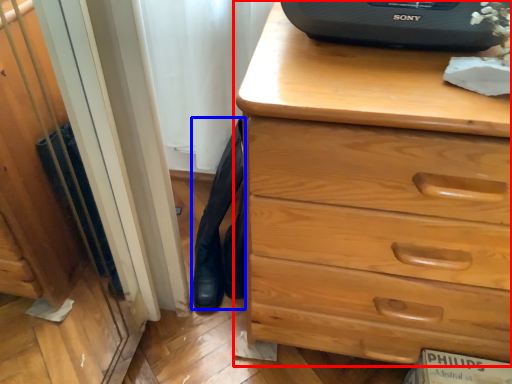
Question: Among these objects, which one is farthest to the camera, chest of drawers (highlighted by a red box) or tight (highlighted by a blue box)?

Choices:
 (A) chest of drawers
 (B) tight

Answer: (B)